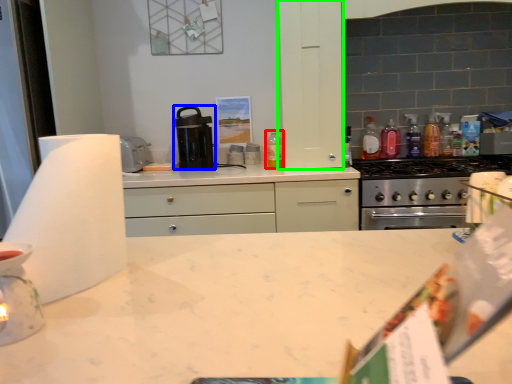
Question: Based on their relative distances, which object is farther from bottle (highlighted by a red box)? Choose from kitchen appliance (highlighted by a blue box) and cabinetry (highlighted by a green box).

Choices:
 (A) kitchen appliance
 (B) cabinetry

Answer: (A)